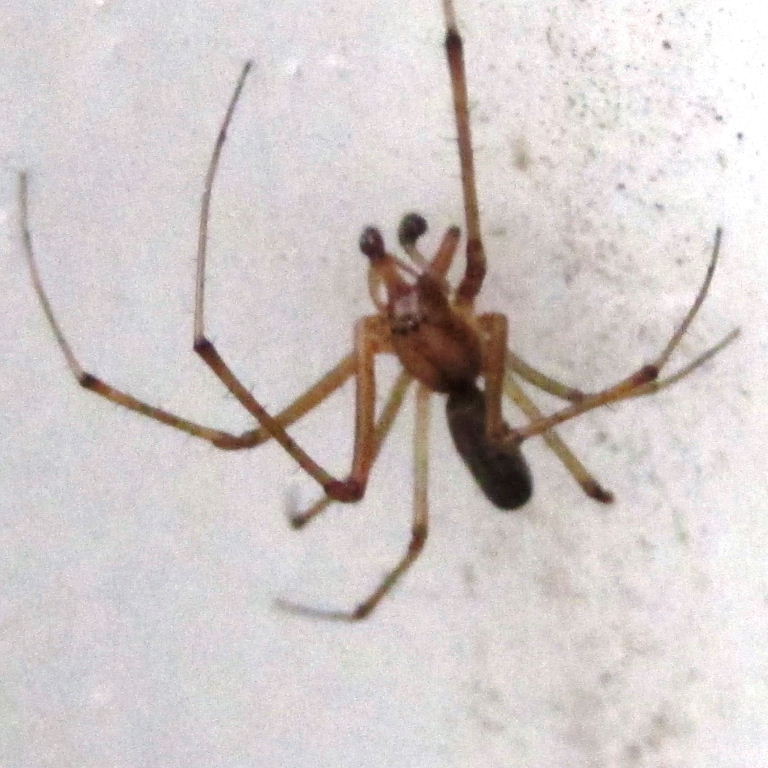
You are a GUI agent. You are given a task and a screenshot of the screen. Output one action in this format:
    pyautogui.click(x=<x>, y=<y>)
    Task: Click on the white wall
    This screenshot has height=768, width=768.
    Given the screenshot: What is the action you would take?
    pyautogui.click(x=368, y=141)